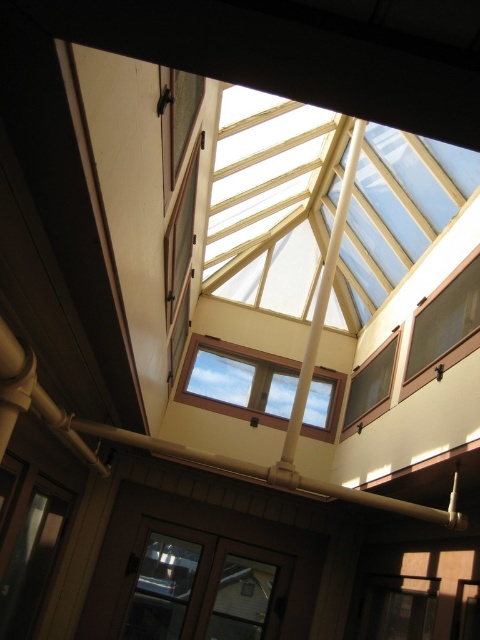
Can you confirm if clear glass window at center is shorter than clear glass window at lower center?

Yes, clear glass window at center is shorter than clear glass window at lower center.

I want to click on clear glass window at center, so click(238, 381).

Image resolution: width=480 pixels, height=640 pixels. Identify the location of clear glass window at center. (238, 381).

Identify the location of clear glass window at center. (238, 381).

What do you see at coordinates (444, 326) in the screenshot? I see `clear glass window at upper right` at bounding box center [444, 326].

Is clear glass window at upper right bigger than clear glass window at lower center?

No.

Is point (448, 301) less distant than point (393, 624)?

Yes, point (448, 301) is in front of point (393, 624).

Locate an element on the screen. The width and height of the screenshot is (480, 640). clear glass window at upper right is located at coordinates (444, 326).

Who is higher up, clear glass window at center or clear glass window at upper right?

Positioned higher is clear glass window at upper right.

Can you confirm if clear glass window at center is shorter than clear glass window at upper right?

Yes.

Where is `clear glass window at center`? The width and height of the screenshot is (480, 640). clear glass window at center is located at coordinates (238, 381).